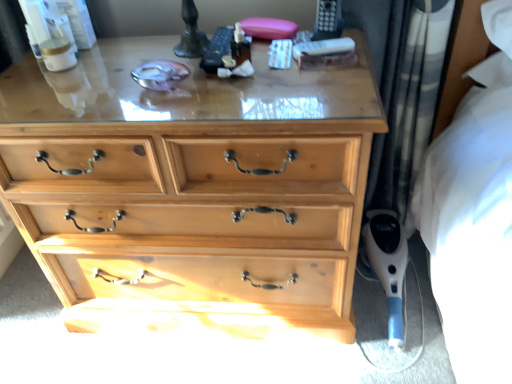
Question: From the image's perspective, would you say blue plastic vacuum cleaner at lower right is positioned over natural wood chest of drawers at center?

Choices:
 (A) yes
 (B) no

Answer: (B)

Question: Can you confirm if blue plastic vacuum cleaner at lower right is thinner than natural wood chest of drawers at center?

Choices:
 (A) no
 (B) yes

Answer: (B)

Question: Can you confirm if blue plastic vacuum cleaner at lower right is wider than natural wood chest of drawers at center?

Choices:
 (A) no
 (B) yes

Answer: (A)

Question: Does blue plastic vacuum cleaner at lower right come behind natural wood chest of drawers at center?

Choices:
 (A) no
 (B) yes

Answer: (B)

Question: Is blue plastic vacuum cleaner at lower right to the right of natural wood chest of drawers at center from the viewer's perspective?

Choices:
 (A) no
 (B) yes

Answer: (B)

Question: In terms of height, does plaid fabric curtain at right look taller or shorter compared to blue plastic vacuum cleaner at lower right?

Choices:
 (A) tall
 (B) short

Answer: (A)

Question: Would you say plaid fabric curtain at right is to the left or to the right of blue plastic vacuum cleaner at lower right in the picture?

Choices:
 (A) left
 (B) right

Answer: (A)

Question: From the image's perspective, is plaid fabric curtain at right located above or below blue plastic vacuum cleaner at lower right?

Choices:
 (A) above
 (B) below

Answer: (A)

Question: In terms of size, does plaid fabric curtain at right appear bigger or smaller than blue plastic vacuum cleaner at lower right?

Choices:
 (A) big
 (B) small

Answer: (A)

Question: Is point pyautogui.click(x=379, y=271) positioned closer to the camera than point pyautogui.click(x=390, y=92)?

Choices:
 (A) closer
 (B) farther

Answer: (B)

Question: From their relative heights in the image, would you say blue plastic vacuum cleaner at lower right is taller or shorter than plaid fabric curtain at right?

Choices:
 (A) tall
 (B) short

Answer: (B)

Question: Looking at their shapes, would you say blue plastic vacuum cleaner at lower right is wider or thinner than plaid fabric curtain at right?

Choices:
 (A) thin
 (B) wide

Answer: (B)

Question: In the image, is blue plastic vacuum cleaner at lower right positioned in front of or behind plaid fabric curtain at right?

Choices:
 (A) front
 (B) behind

Answer: (B)

Question: Is natural wood chest of drawers at center spatially inside plaid fabric curtain at right, or outside of it?

Choices:
 (A) outside
 (B) inside

Answer: (A)

Question: From their relative heights in the image, would you say natural wood chest of drawers at center is taller or shorter than plaid fabric curtain at right?

Choices:
 (A) tall
 (B) short

Answer: (B)